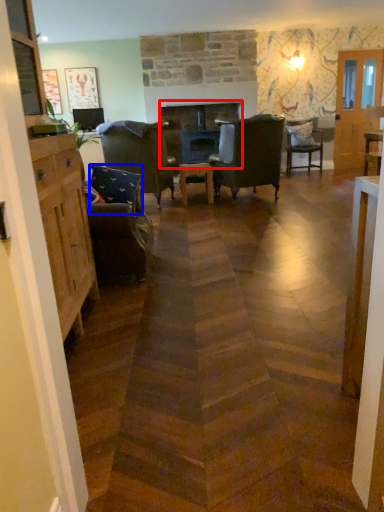
Question: Among these objects, which one is nearest to the camera, fireplace (highlighted by a red box) or pillow (highlighted by a blue box)?

Choices:
 (A) fireplace
 (B) pillow

Answer: (B)